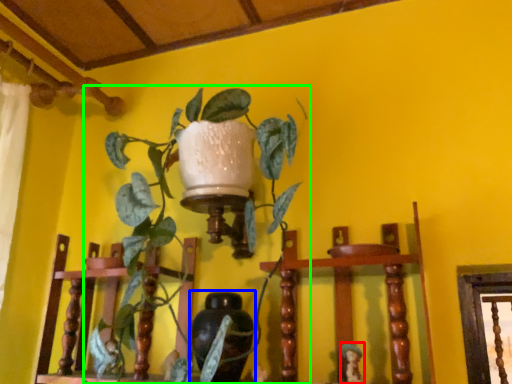
Question: Estimate the real-world distances between objects in this image. Which object is closer to toy (highlighted by a red box), vase (highlighted by a blue box) or houseplant (highlighted by a green box)?

Choices:
 (A) vase
 (B) houseplant

Answer: (A)